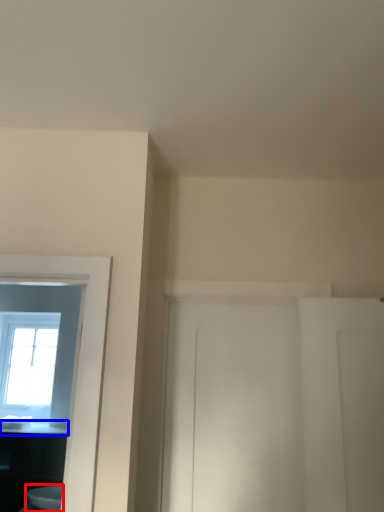
Question: Which of the following is the closest to the observer, toilet (highlighted by a red box) or counter top (highlighted by a blue box)?

Choices:
 (A) toilet
 (B) counter top

Answer: (A)